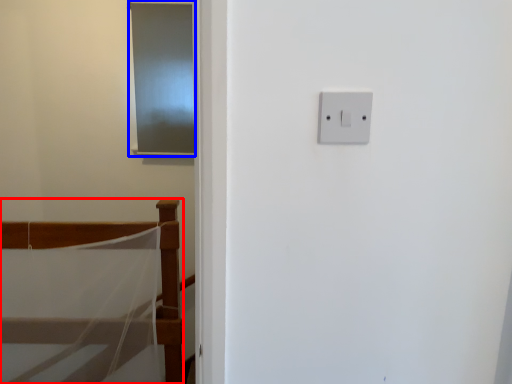
Question: Which of the following is the closest to the observer, furniture (highlighted by a red box) or screen door (highlighted by a blue box)?

Choices:
 (A) furniture
 (B) screen door

Answer: (A)